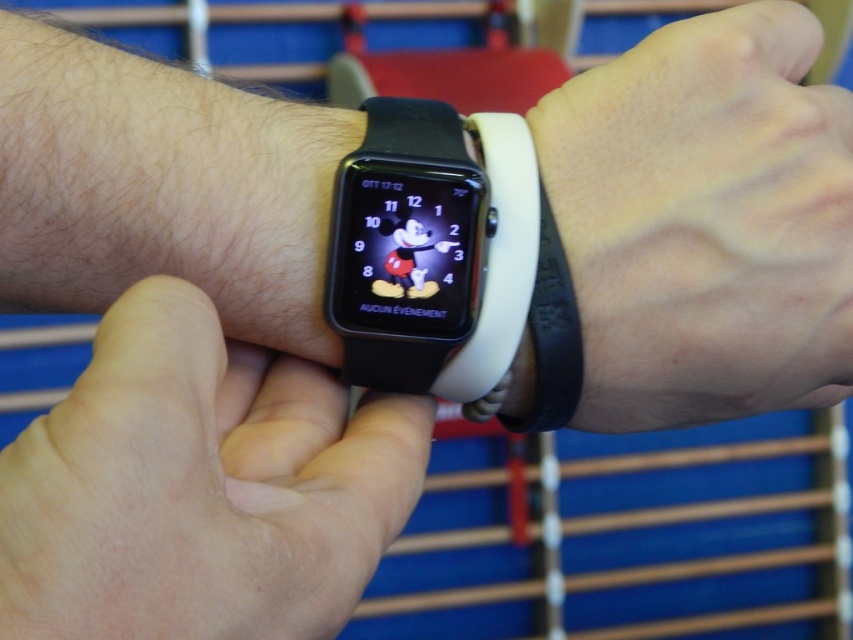
Question: Which object is closer to the camera taking this photo?

Choices:
 (A) black matte wristband at lower right
 (B) black rubber watch at center
 (C) white rubber band at center

Answer: (B)

Question: Does skinny white wristband at center come in front of white rubber band at center?

Choices:
 (A) yes
 (B) no

Answer: (A)

Question: Which of the following is the farthest from the observer?

Choices:
 (A) white rubber band at center
 (B) black matte wristband at lower right

Answer: (A)

Question: Does black matte wristband at lower right come behind black rubber watch at center?

Choices:
 (A) no
 (B) yes

Answer: (B)

Question: Is the position of black matte wristband at lower right less distant than that of white rubber band at center?

Choices:
 (A) yes
 (B) no

Answer: (A)

Question: Which object appears closest to the camera in this image?

Choices:
 (A) white rubber band at center
 (B) black rubber watch at center
 (C) skinny white wristband at center
 (D) black matte wristband at lower right

Answer: (C)